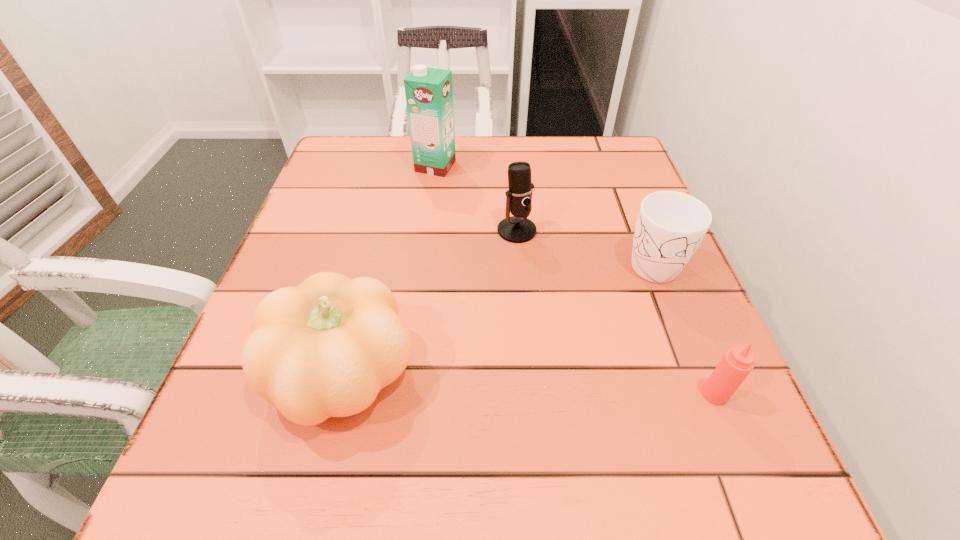
Locate an element on the screen. Image resolution: width=960 pixels, height=540 pixels. vacant region at the far right corner is located at coordinates (593, 184).

In the image, there is a desktop. Identify the location of blank space at the near right corner. (766, 478).

Identify the location of free point between the microphone and the carton. (476, 198).

Locate an element on the screen. This screenshot has width=960, height=540. empty space that is in between the pumpkin and the mug is located at coordinates (498, 317).

At what (x,y) coordinates should I click in order to perform the action: click on free space between the pumpkin and the Tabasco sauce. Please return your answer as a coordinate pair (x, y). Looking at the image, I should click on (530, 384).

This screenshot has width=960, height=540. Identify the location of free space between the microphone and the mug. (584, 245).

In order to click on vacant space that's between the Tabasco sauce and the mug in this screenshot , I will do `click(683, 327)`.

At what (x,y) coordinates should I click in order to perform the action: click on free space between the Tabasco sauce and the farthest object. Please return your answer as a coordinate pair (x, y). Image resolution: width=960 pixels, height=540 pixels. Looking at the image, I should click on (575, 280).

This screenshot has height=540, width=960. Identify the location of blank region between the carton and the pumpkin. (391, 269).

The image size is (960, 540). What are the coordinates of `vacant space that is in between the pumpkin and the Tabasco sauce` in the screenshot? It's located at (530, 384).